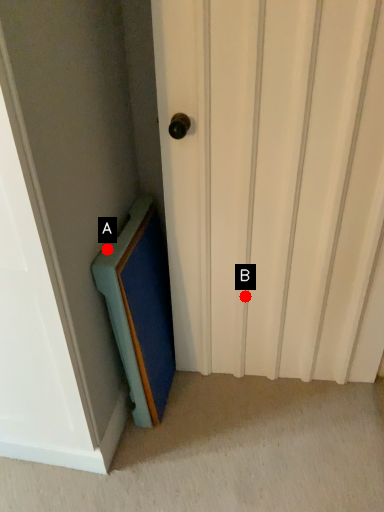
Question: Two points are circled on the image, labeled by A and B beside each circle. Which point is farther to the camera?

Choices:
 (A) A is further
 (B) B is further

Answer: (B)